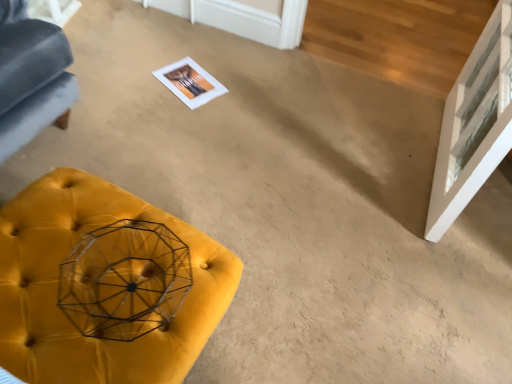
Identify the location of free spot in front of transparent glass door at upper right. The height and width of the screenshot is (384, 512). (416, 264).